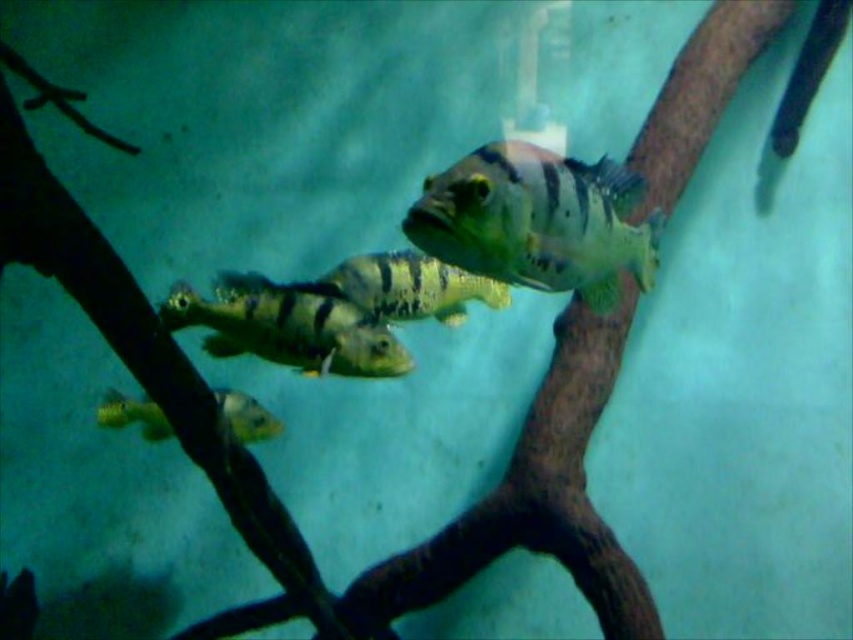
You are an underwater photographer aiming to capture the shiny green fish at center. Based on the coordinates given, where should you position your camera to ensure the fish is centered in your shot?

To center the shiny green fish at center in your shot, position your camera at the coordinates provided, which are at point (537, 221).

From the picture: You are an underwater photographer aiming to capture a clear image of both the shiny green fish at center and the green striped fish at center. Since you can only focus on one fish at a time, which fish should you focus on to ensure the other remains somewhat in focus due to their relative positions?

You should focus on the shiny green fish at center because it is closer to the viewer than the green striped fish at center. By focusing on the closer fish, the depth of field may allow the farther fish to remain somewhat in focus.

You are an underwater explorer observing the fish in the aquarium. You notice two points marked in the scene. Which point is nearer to you, point (553, 180) or point (149, 403)?

Point (553, 180) is closer to the viewer than point (149, 403).